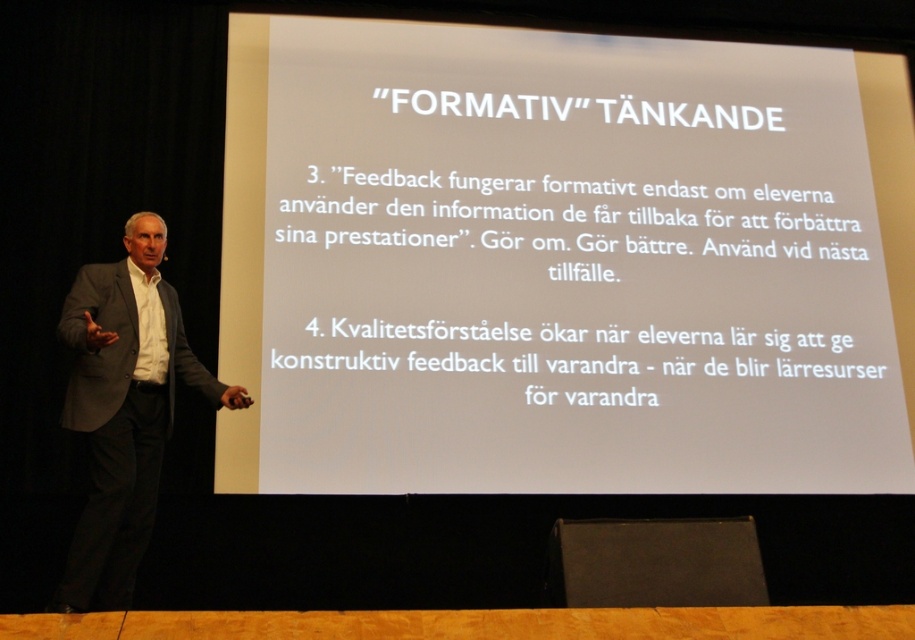
Does point (647, 186) come in front of point (146, 368)?

No, (647, 186) is behind (146, 368).

Is white paper at upper center thinner than dark gray suit at left?

Incorrect, white paper at upper center's width is not less than dark gray suit at left's.

Where is `white paper at upper center`? The width and height of the screenshot is (915, 640). white paper at upper center is located at coordinates (562, 262).

Is dark gray suit at left thinner than black fabric speaker at lower center?

Yes.

Is dark gray suit at left closer to camera compared to black fabric speaker at lower center?

No, it is not.

Is point (148, 461) positioned after point (666, 540)?

Yes, point (148, 461) is farther from viewer.

At what (x,y) coordinates should I click in order to perform the action: click on dark gray suit at left. Please return your answer as a coordinate pair (x, y). Looking at the image, I should click on (124, 410).

Is white paper at upper center further to camera compared to black fabric speaker at lower center?

Yes, it is.

Which of these two, white paper at upper center or black fabric speaker at lower center, stands taller?

white paper at upper center is taller.

At what (x,y) coordinates should I click in order to perform the action: click on white paper at upper center. Please return your answer as a coordinate pair (x, y). The width and height of the screenshot is (915, 640). Looking at the image, I should click on (562, 262).

The width and height of the screenshot is (915, 640). Find the location of `white paper at upper center`. white paper at upper center is located at coordinates (562, 262).